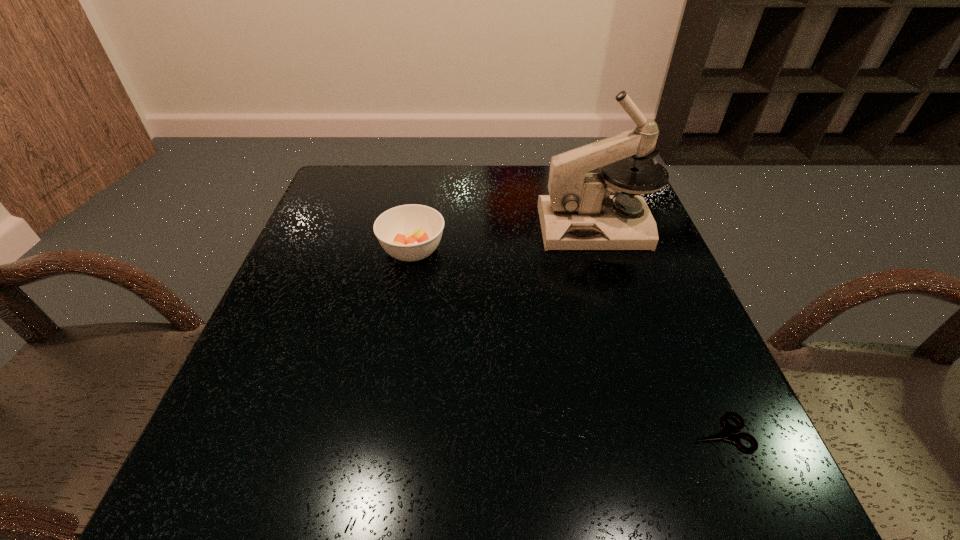
This screenshot has height=540, width=960. What are the coordinates of `empty space between the tallest object and the soup bowl` in the screenshot? It's located at (504, 239).

Find the location of `vacant space that's between the shears and the microscope`. vacant space that's between the shears and the microscope is located at coordinates (658, 330).

The image size is (960, 540). In order to click on the second closest object to the leftmost object in this screenshot , I will do [725, 433].

Locate which object ranks second in proximity to the shears. Please provide its 2D coordinates. Your answer should be formatted as a tuple, i.e. [(x, y)], where the tuple contains the x and y coordinates of a point satisfying the conditions above.

[(412, 232)]

Where is `vacant space that satisfies the following two spatial constraints: 1. at the eyepiece of the microscope; 2. on the right side of the shortest object`? This screenshot has width=960, height=540. vacant space that satisfies the following two spatial constraints: 1. at the eyepiece of the microscope; 2. on the right side of the shortest object is located at coordinates (661, 433).

What are the coordinates of `free space that satisfies the following two spatial constraints: 1. at the eyepiece of the microscope; 2. on the front side of the second tallest object` in the screenshot? It's located at (603, 251).

Locate an element on the screen. The image size is (960, 540). vacant region that satisfies the following two spatial constraints: 1. at the eyepiece of the shortest object; 2. on the left side of the tallest object is located at coordinates (661, 433).

The width and height of the screenshot is (960, 540). In order to click on vacant region that satisfies the following two spatial constraints: 1. at the eyepiece of the microscope; 2. on the right side of the nearest object in this screenshot , I will do `click(661, 433)`.

Locate an element on the screen. vacant space that satisfies the following two spatial constraints: 1. on the front side of the nearest object; 2. on the left side of the leftmost object is located at coordinates (380, 433).

Find the location of a particular element. vacant space that satisfies the following two spatial constraints: 1. at the eyepiece of the tallest object; 2. on the front side of the leftmost object is located at coordinates (603, 251).